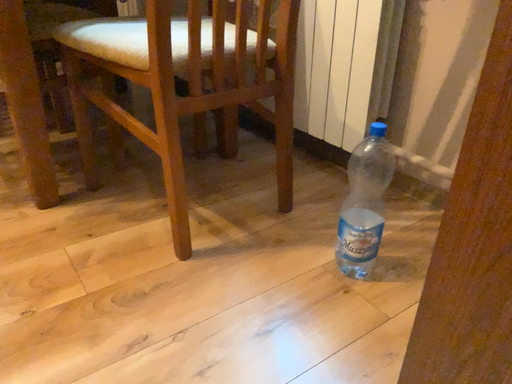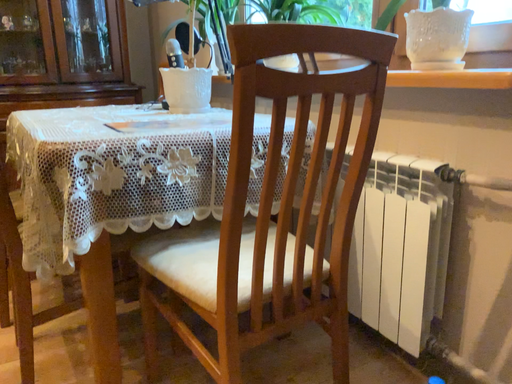
Question: How did the camera likely rotate when shooting the video?

Choices:
 (A) rotated upward
 (B) rotated downward

Answer: (A)